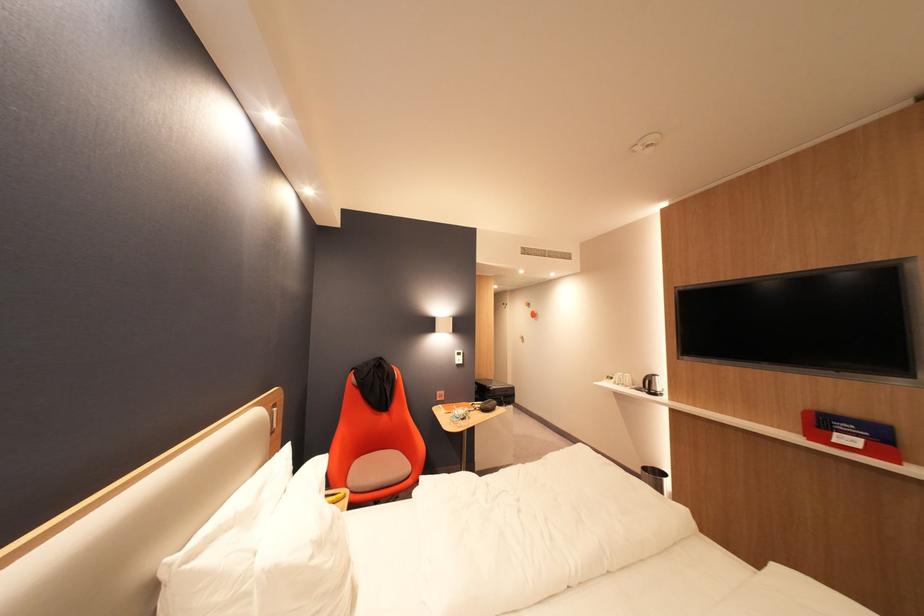
This screenshot has width=924, height=616. What do you see at coordinates (493, 391) in the screenshot?
I see `the suitcase handle` at bounding box center [493, 391].